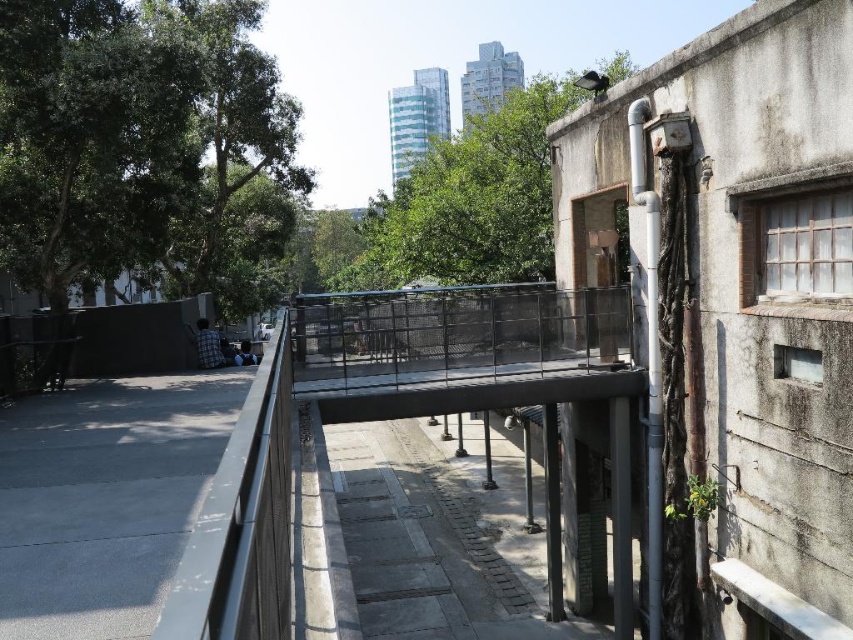
Is green leafy tree at left positioned before green leafy tree at center?

Yes.

Locate an element on the screen. The width and height of the screenshot is (853, 640). green leafy tree at left is located at coordinates (141, 145).

Is point (250, 168) positioned after point (490, 275)?

No, (250, 168) is in front of (490, 275).

Identify the location of green leafy tree at left. [x=141, y=145].